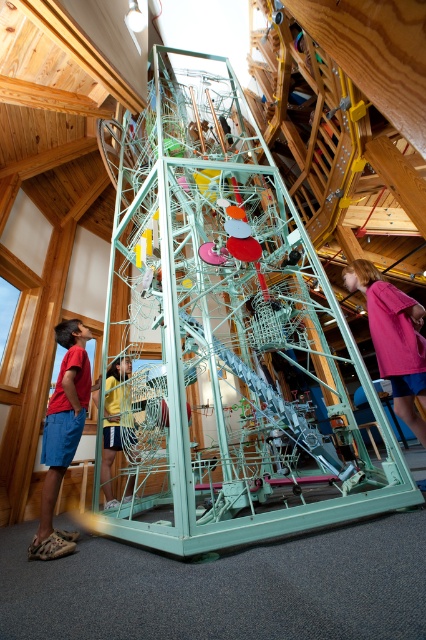
You are standing in the center of the room and see the point at coordinates (63, 435). What object is located there?

The point at coordinates (63, 435) is occupied by the matte red shirt at left.

You are standing in the room with the mechanical installation and notice two clothing items. The pink fabric shirt at lower right and the yellow fabric shorts at center. Which clothing item is positioned to the right side of the other?

The pink fabric shirt at lower right is to the right of the yellow fabric shorts at center.

You are a fashion designer observing an art installation. You notice a matte red shirt at left and a yellow fabric shorts at center. Which clothing item is shorter in height?

The matte red shirt at left is shorter than the yellow fabric shorts at center.